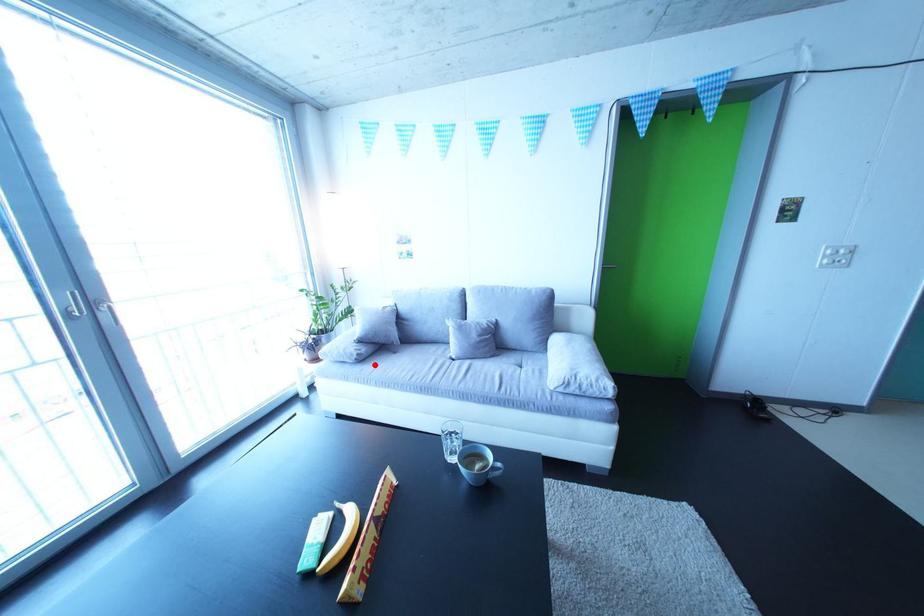
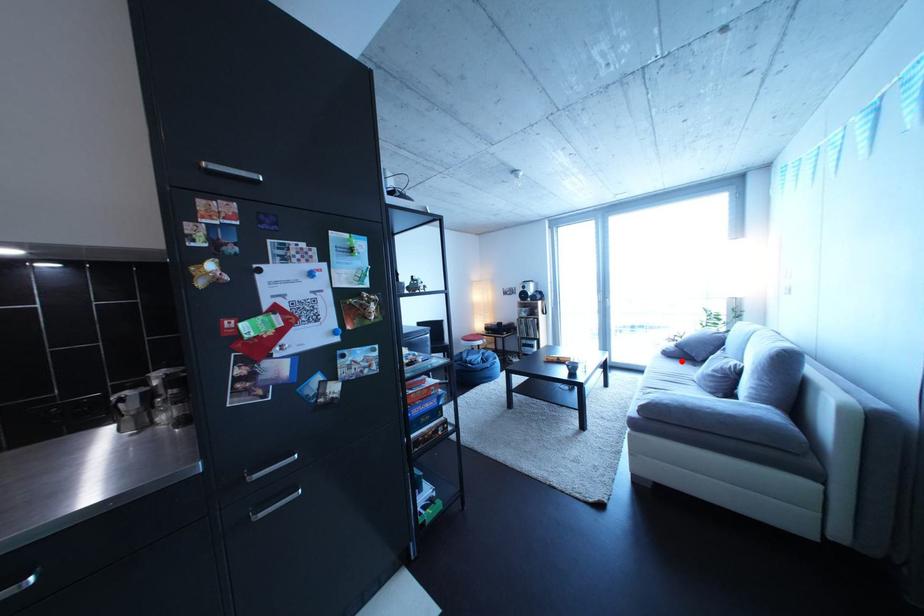
I am providing you with two images of the same scene from different viewpoints. A red point is marked on the first image and another point is marked on the second image. Does the point marked in image1 correspond to the same location as the one in image2?

Yes